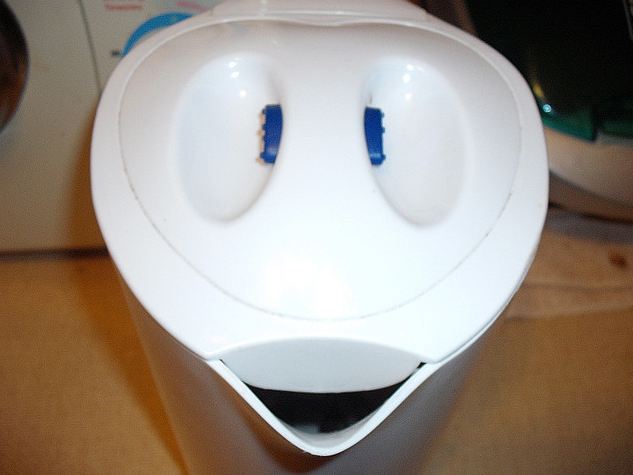
The height and width of the screenshot is (475, 633). I want to click on white pitcher lip, so click(x=285, y=431).